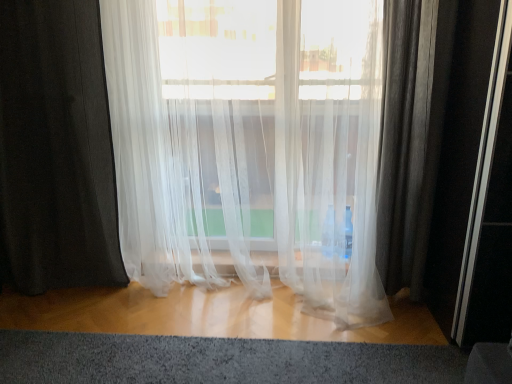
In order to click on free location above textured gray carpet at lower center (from a real-world perspective) in this screenshot , I will do `click(229, 367)`.